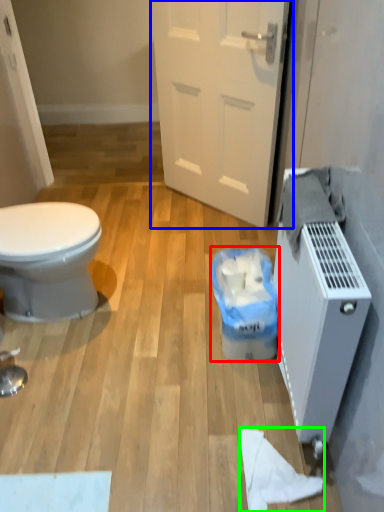
Question: Which is nearer to the garbage (highlighted by a red box)? door (highlighted by a blue box) or toilet paper (highlighted by a green box).

Choices:
 (A) door
 (B) toilet paper

Answer: (B)